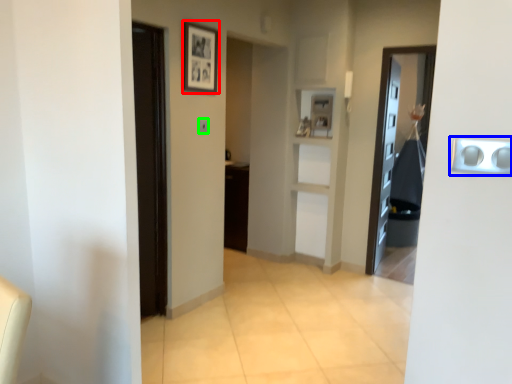
Question: Which is farther away from picture frame (highlighted by a red box)? door handle (highlighted by a blue box) or light switch (highlighted by a green box)?

Choices:
 (A) door handle
 (B) light switch

Answer: (A)